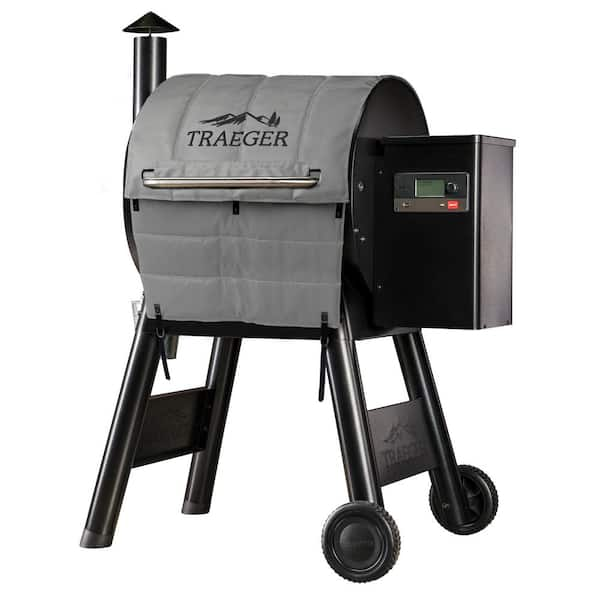
The image size is (600, 600). Find the location of `handle`. handle is located at coordinates (271, 184).